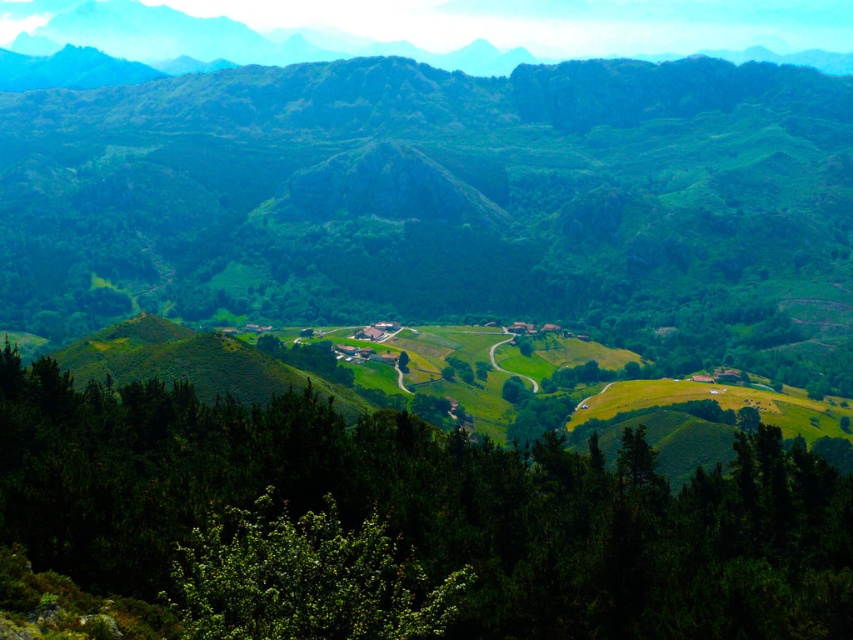
You are standing at the center of the image and want to find the green leafy bush at lower center. According to the coordinates provided, in which direction should you look to locate it?

The green leafy bush at lower center is located at point coordinates, so you should look downward from the center to find it.

You are a hiker standing at the base of the mountain, looking at the green leafy bush at lower center and the green leafy tree at center. Which object is closer to you?

The green leafy bush at lower center is closer to you because it is positioned in front of the green leafy tree at center.

You are planning to plant a new tree in the mountain landscape. The green matte tree at center and the green leafy tree at center are both present. Which tree would cast a larger shadow during midday when the sun is directly overhead?

The green matte tree at center would cast a larger shadow because it is bigger than the green leafy tree at center.